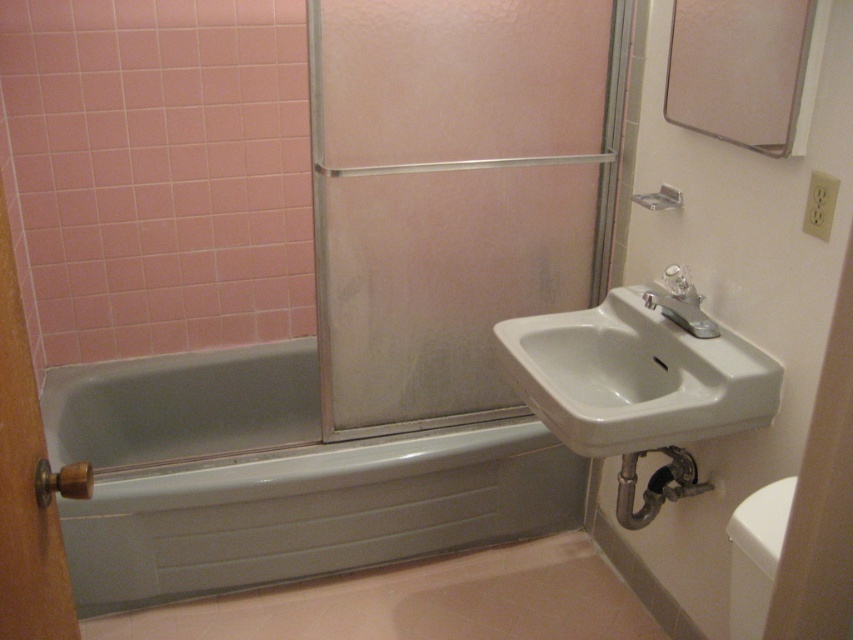
You are trying to reach both the wooden knob at left and the matte silver shower at upper center in the bathroom. Which one do you need to stretch higher to reach?

The wooden knob at left is much taller than the matte silver shower at upper center, so you need to stretch higher to reach the wooden knob at left.

You are standing in the bathroom and want to know which of the two points, point (x=48, y=580) or point (x=669, y=188), is closer to you. Based on the image, which point is nearer?

Point (x=48, y=580) is closer to the camera than point (x=669, y=188), so it is the nearer one.